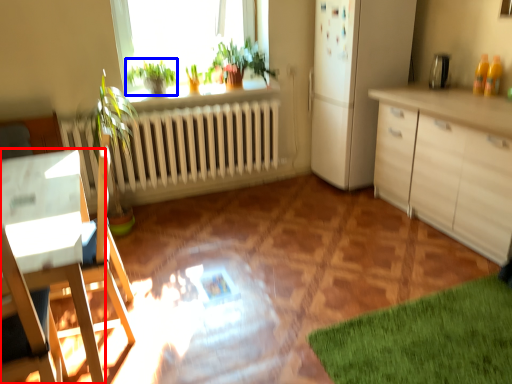
Question: Which point is further to the camera, desk (highlighted by a red box) or plant (highlighted by a blue box)?

Choices:
 (A) desk
 (B) plant

Answer: (B)